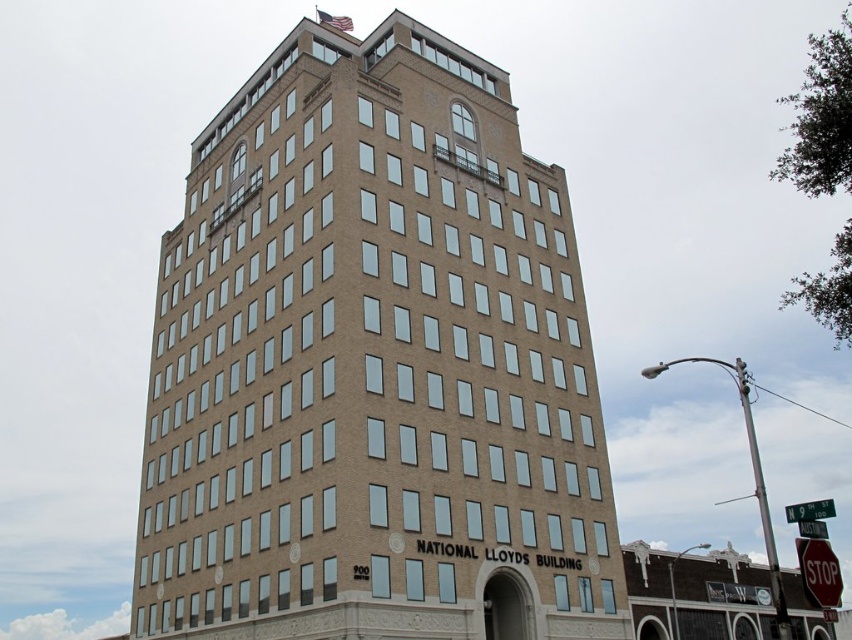
You are standing at the center of the image. Based on the scene, where is the brown brick building at center located in terms of its 2D coordinates?

The brown brick building at center is located at the 2D coordinates of point (373, 365).